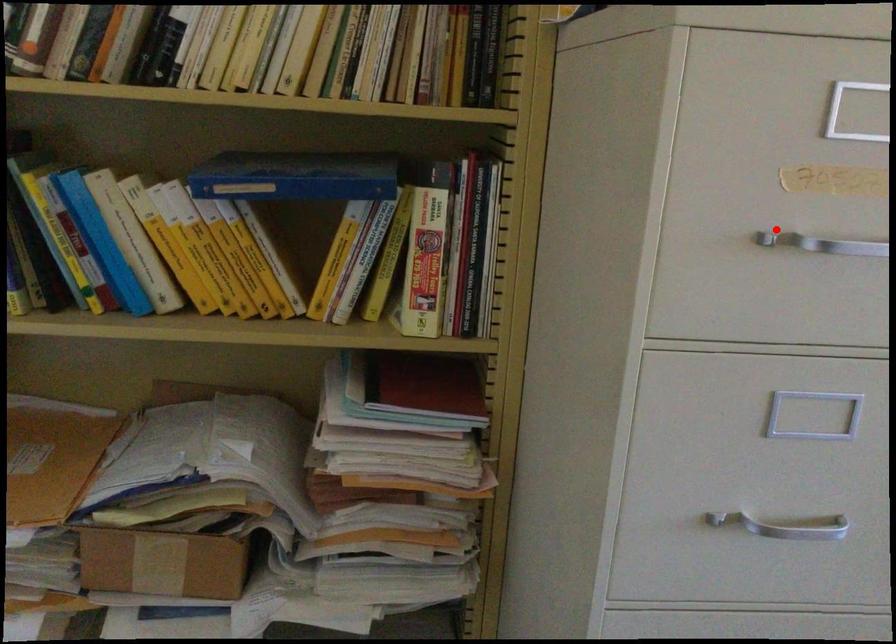
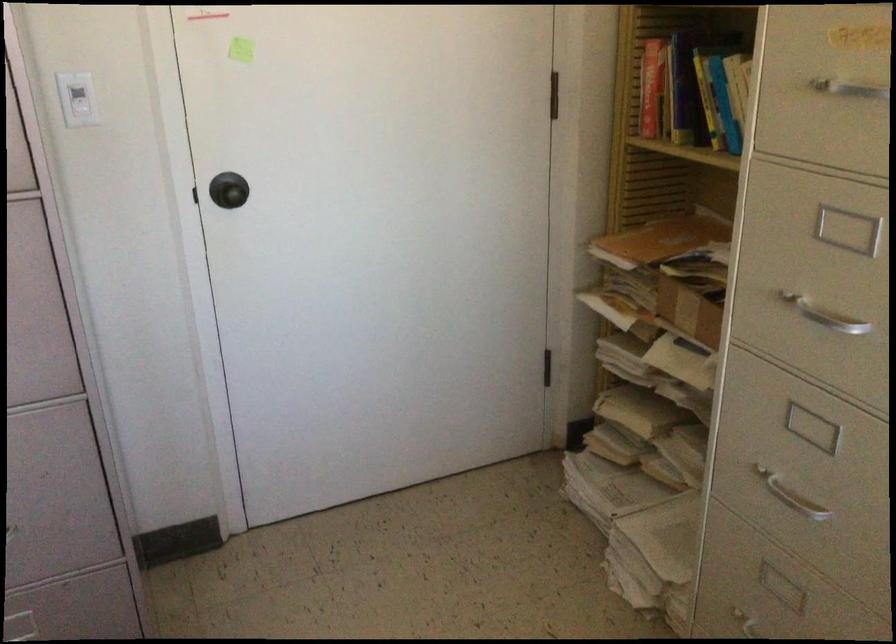
Question: I am providing you with two images of the same scene from different viewpoints. A red point is marked on the first image. At the location where the point appears in image 1, is it still visible in image 2?

Choices:
 (A) Yes
 (B) No

Answer: (A)